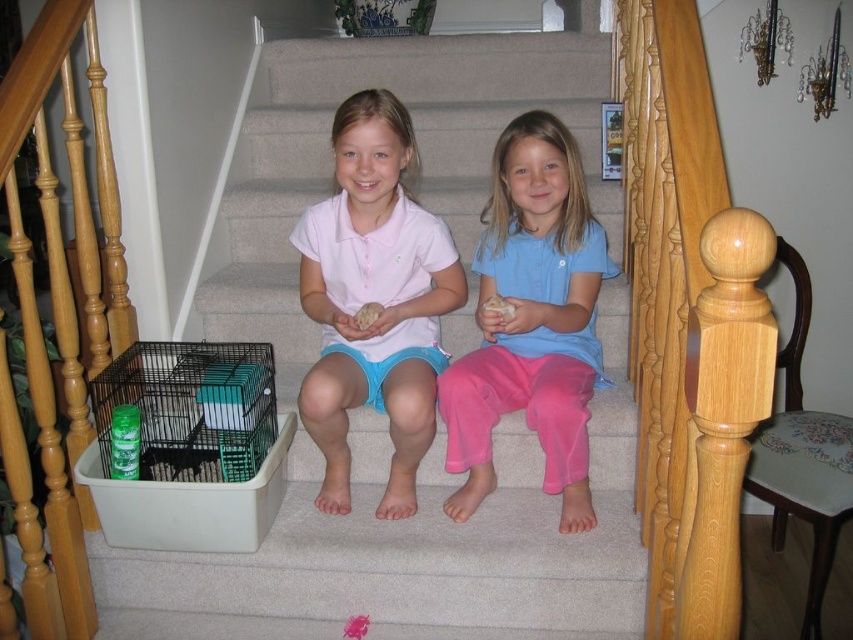
You are trying to decide which shirt to wear for a day at the beach. Both the matte pink shirt at center and the blue cotton shirt at center are options. Based on their thickness, which one would be more comfortable in the heat?

The matte pink shirt at center is thinner than the blue cotton shirt at center, so it would be more comfortable in the heat as thinner fabrics allow better airflow and cooling.

You are standing at the point labeled point (457,400) and want to walk to the point labeled point (317,496). According to the scene, will you have to walk forward or backward to reach your destination?

Since point (317,496) is behind point (457,400), you will have to walk backward to reach it.

You are a photographer taking a picture of the blue cotton shirt at center and the fluffy beige hamster at center. Which object will appear larger in the photo?

The blue cotton shirt at center will appear larger in the photo because it is closer to the viewer than the fluffy beige hamster at center.